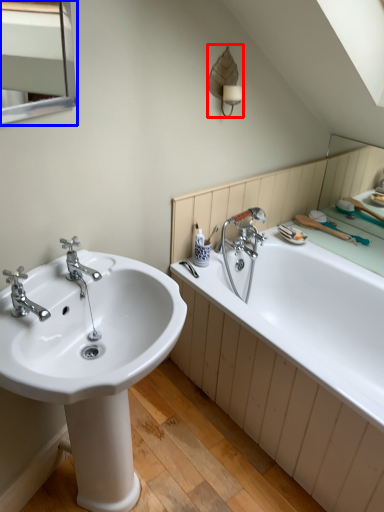
Question: Which of the following is the closest to the observer, fixture (highlighted by a red box) or medicine cabinet (highlighted by a blue box)?

Choices:
 (A) fixture
 (B) medicine cabinet

Answer: (B)